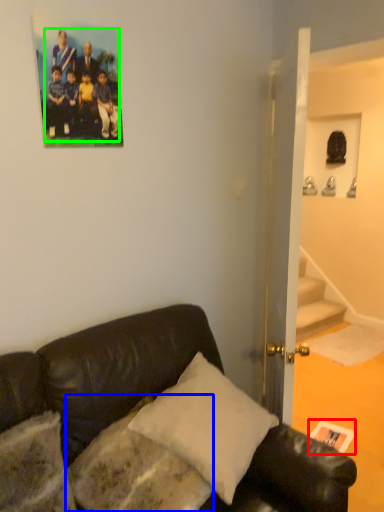
Question: Which object is the farthest from postcard (highlighted by a red box)? Choose among these: pillow (highlighted by a blue box) or football team (highlighted by a green box).

Choices:
 (A) pillow
 (B) football team

Answer: (B)